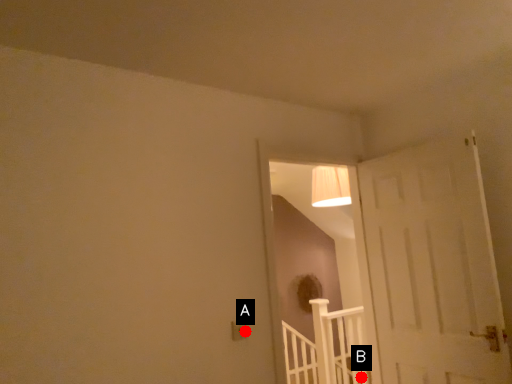
Question: Two points are circled on the image, labeled by A and B beside each circle. Among these points, which one is nearest to the camera?

Choices:
 (A) A is closer
 (B) B is closer

Answer: (A)